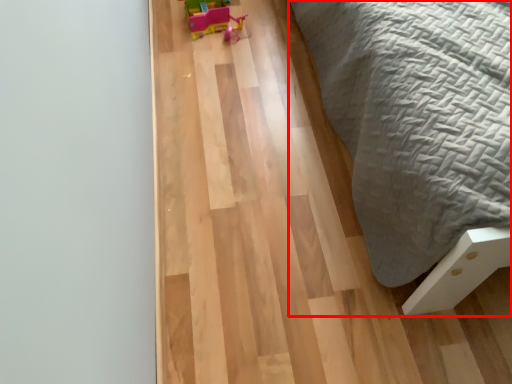
Question: In this image, where is furniture (annotated by the red box) located relative to toy?

Choices:
 (A) right
 (B) left

Answer: (A)